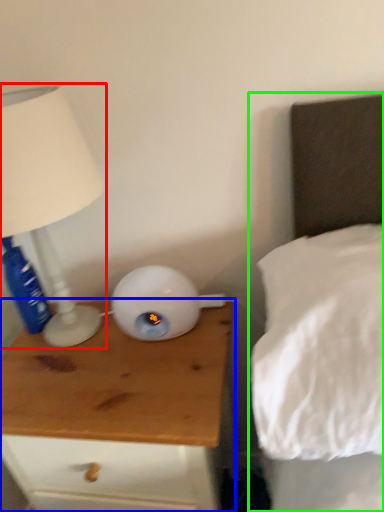
Question: Estimate the real-world distances between objects in this image. Which object is closer to lamp (highlighted by a red box), nightstand (highlighted by a blue box) or bed (highlighted by a green box)?

Choices:
 (A) nightstand
 (B) bed

Answer: (A)